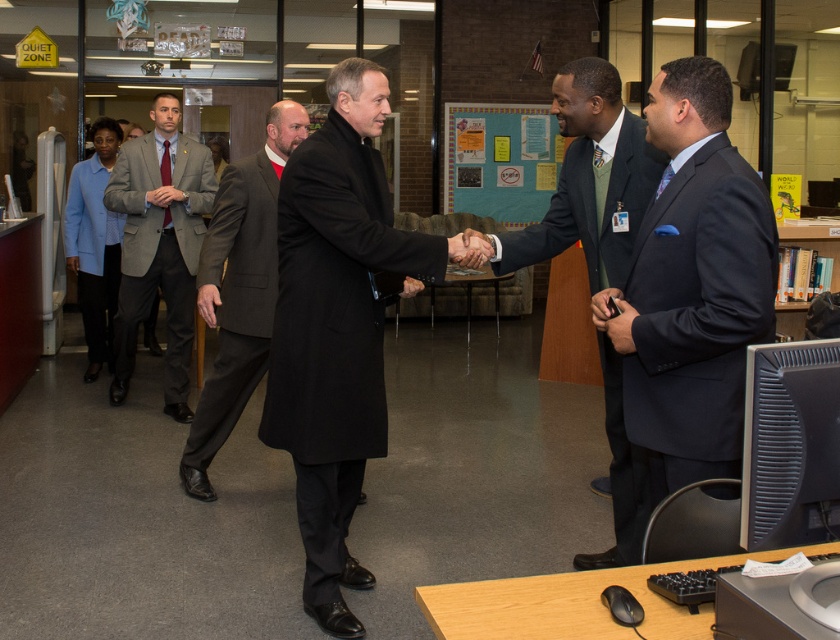
You are an event planner arranging seating for a meeting. You need to place two attendees wearing the dark blue suit at right and the gray wool suit at center. According to their positions in the image, which attendee should you seat closer to the front of the room?

The dark blue suit at right should be seated closer to the front of the room because it is located below the gray wool suit at center in the image, indicating they are positioned lower in the frame and possibly closer to the front.

You are organizing a seating arrangement for a meeting and need to place the gray wool suit at center and the light blue fabric jacket at left. Which one requires a larger space for seating?

The gray wool suit at center requires a larger space for seating because it is bigger than the light blue fabric jacket at left.

You are an event planner arranging seating for a formal meeting. You need to seat the dark blue suit at right and the gray wool suit at center such that the taller person sits in the front row. Based on the image, which person should you seat in the front row?

The gray wool suit at center should be seated in the front row because the dark blue suit at right has a lesser height compared to gray wool suit at center, indicating the gray wool suit at center is taller.